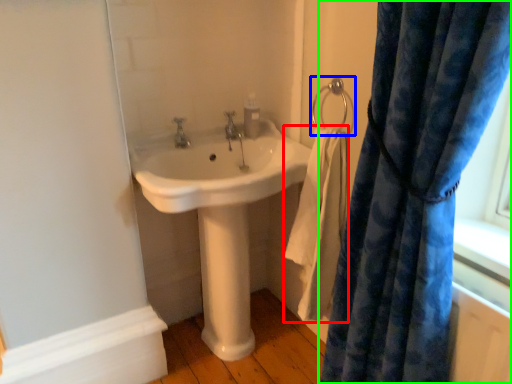
Question: Based on their relative distances, which object is nearer to bath towel (highlighted by a red box)? Choose from shower (highlighted by a blue box) and curtain (highlighted by a green box).

Choices:
 (A) shower
 (B) curtain

Answer: (A)